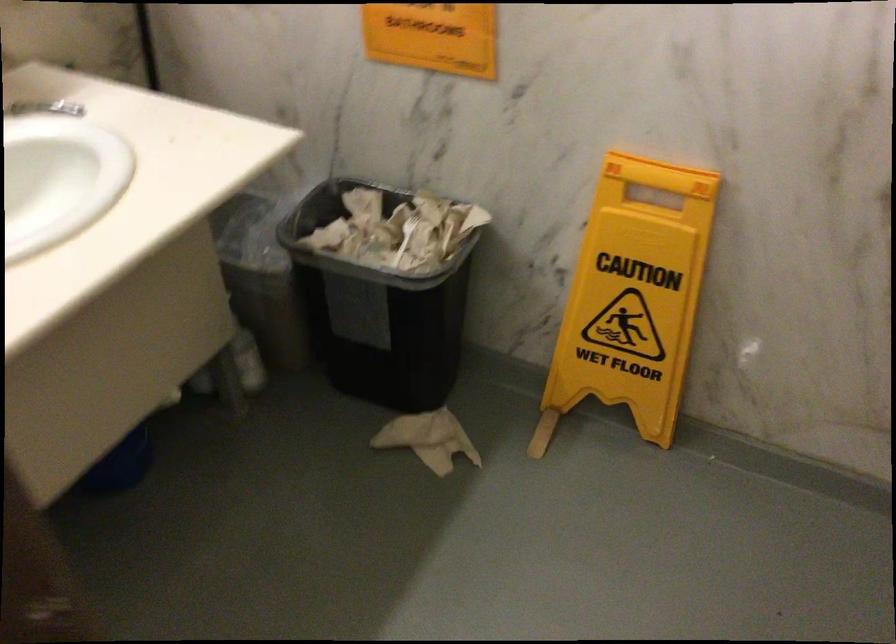
Find where to lift the black trash can. Please return your answer as a coordinate pair (x, y).

(376, 310)